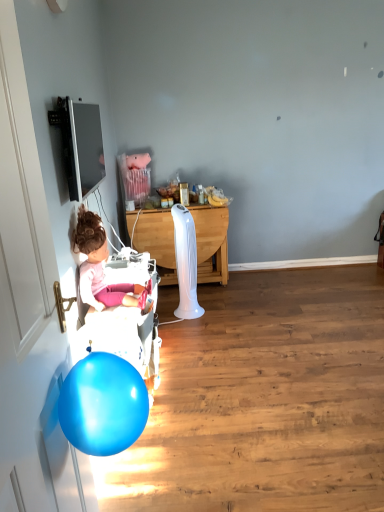
Question: From a real-world perspective, is white wood desk at center physically located above or below matte pink doll at left?

Choices:
 (A) above
 (B) below

Answer: (B)

Question: From their relative heights in the image, would you say white wood desk at center is taller or shorter than matte pink doll at left?

Choices:
 (A) short
 (B) tall

Answer: (B)

Question: Which object is the closest to the white glossy door at left?

Choices:
 (A) white plastic baby carriage at left
 (B) matte pink doll at left
 (C) white wood desk at center

Answer: (B)

Question: Estimate the real-world distances between objects in this image. Which object is farther from the matte pink doll at left?

Choices:
 (A) white glossy door at left
 (B) white wood desk at center
 (C) white plastic baby carriage at left

Answer: (B)